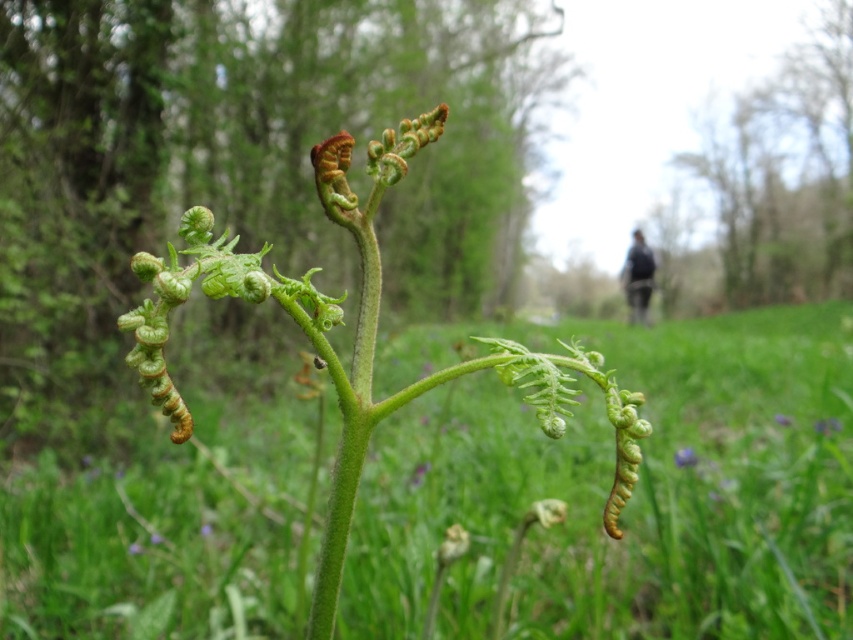
You are a gardener trying to arrange plants in a symmetrical pattern. You have the green matte fern at center and the purple matte flower at center. Based on their current positions, which plant should you move to the right to create symmetry?

The green matte fern at center should be moved to the right to create symmetry since it is currently positioned on the left side of the purple matte flower at center.

You are standing in a garden and want to reach a specific point marked at coordinates point (643, 307). If you can walk 10 meters in a straight line, will you be able to reach that point?

The distance of point (643, 307) from viewer is 9.20 meters, so yes, you can reach it since it is within your 10 meters walking range.